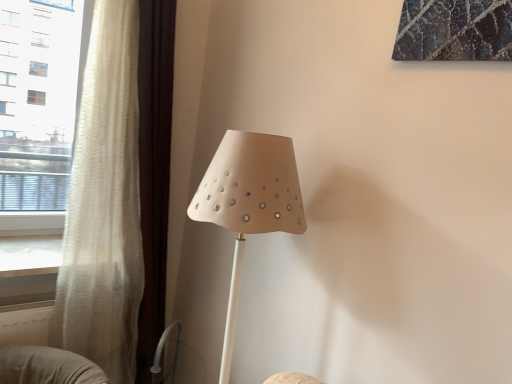
Question: Based on their sizes in the image, would you say white textured curtain at left is bigger or smaller than matte beige lampshade at center?

Choices:
 (A) big
 (B) small

Answer: (A)

Question: Relative to matte beige lampshade at center, is white textured curtain at left in front or behind?

Choices:
 (A) front
 (B) behind

Answer: (B)

Question: Estimate the real-world distances between objects in this image. Which object is closer to the white sheer curtain at left?

Choices:
 (A) matte beige lampshade at center
 (B) white textured curtain at left

Answer: (B)

Question: Which is nearer to the matte beige lampshade at center?

Choices:
 (A) white textured curtain at left
 (B) white sheer curtain at left

Answer: (A)